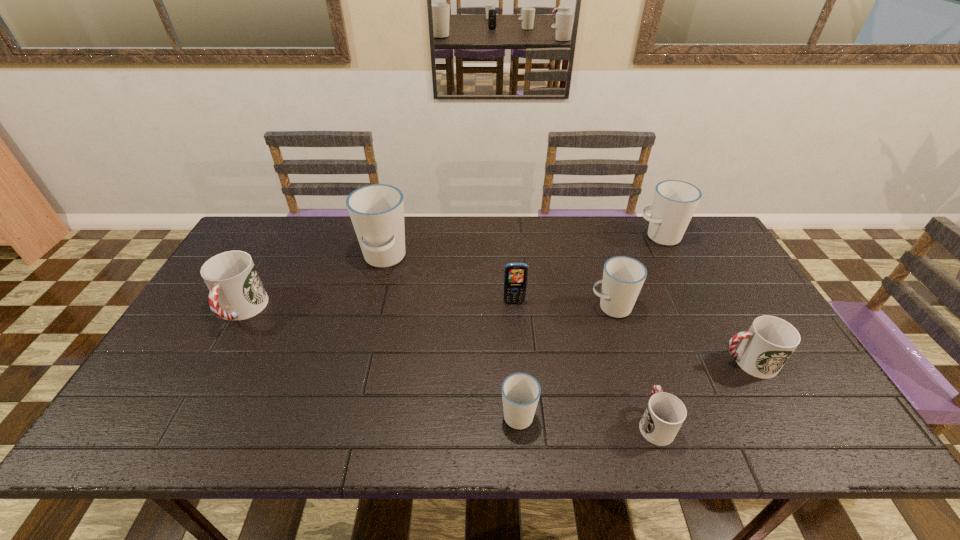
This screenshot has height=540, width=960. In order to click on empty space that is in between the cellular telephone and the smallest red cup in this screenshot , I will do `click(585, 362)`.

Locate which object ranks fifth in proximity to the second smallest white cup. Please provide its 2D coordinates. Your answer should be formatted as a tuple, i.e. [(x, y)], where the tuple contains the x and y coordinates of a point satisfying the conditions above.

[(520, 392)]

The width and height of the screenshot is (960, 540). Find the location of `object that is the seventh closest one to the second tallest object`. object that is the seventh closest one to the second tallest object is located at coordinates (236, 291).

Select which cup is the sixth closest to the cellular telephone. Please provide its 2D coordinates. Your answer should be formatted as a tuple, i.e. [(x, y)], where the tuple contains the x and y coordinates of a point satisfying the conditions above.

[(766, 346)]

In order to click on the fourth closest cup relative to the leftmost white cup in this screenshot , I will do `click(665, 413)`.

This screenshot has height=540, width=960. I want to click on the second closest white cup to the smallest red cup, so click(623, 277).

At what (x,y) coordinates should I click in order to perform the action: click on white cup that stands as the fourth closest to the third nearest cup. Please return your answer as a coordinate pair (x, y). Looking at the image, I should click on (377, 211).

Choose which red cup is the nearest neighbor to the farthest red cup. Please provide its 2D coordinates. Your answer should be formatted as a tuple, i.e. [(x, y)], where the tuple contains the x and y coordinates of a point satisfying the conditions above.

[(665, 413)]

This screenshot has width=960, height=540. I want to click on red cup that is the closest to the third white cup from right to left, so click(x=665, y=413).

Locate an element on the screen. The width and height of the screenshot is (960, 540). free space that satisfies the following two spatial constraints: 1. on the handle side of the shortest object; 2. with a handle on the side of the third biggest white cup is located at coordinates (617, 307).